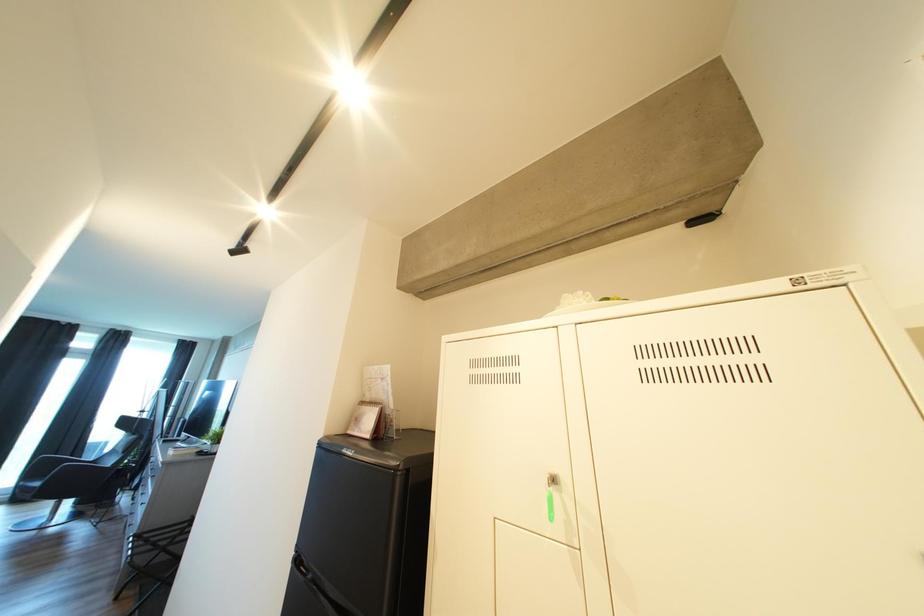
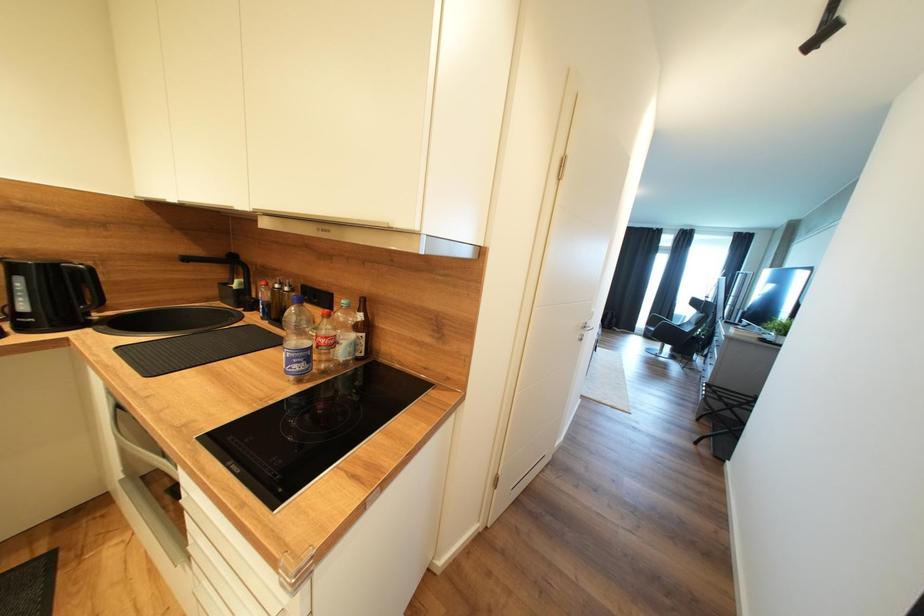
Question: The images are taken continuously from a first-person perspective. In which direction is your viewpoint rotating?

Choices:
 (A) Left
 (B) Right
 (C) Up
 (D) Down

Answer: (A)